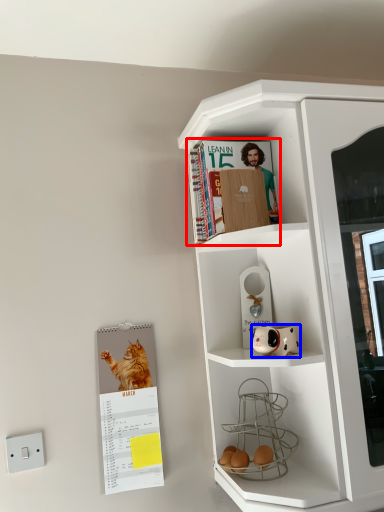
Question: Which point is further to the camera, magazine (highlighted by a red box) or toy (highlighted by a blue box)?

Choices:
 (A) magazine
 (B) toy

Answer: (A)